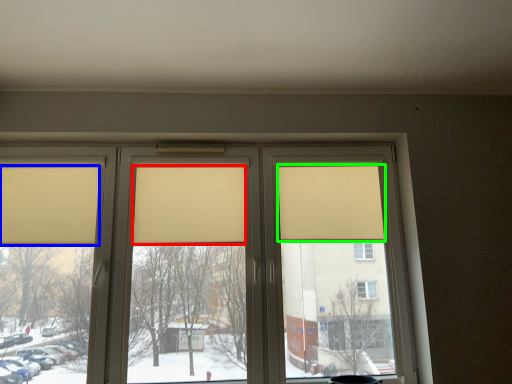
Question: Based on their relative distances, which object is farther from curtain (highlighted by a red box)? Choose from curtain (highlighted by a blue box) and curtain (highlighted by a green box).

Choices:
 (A) curtain
 (B) curtain

Answer: (B)